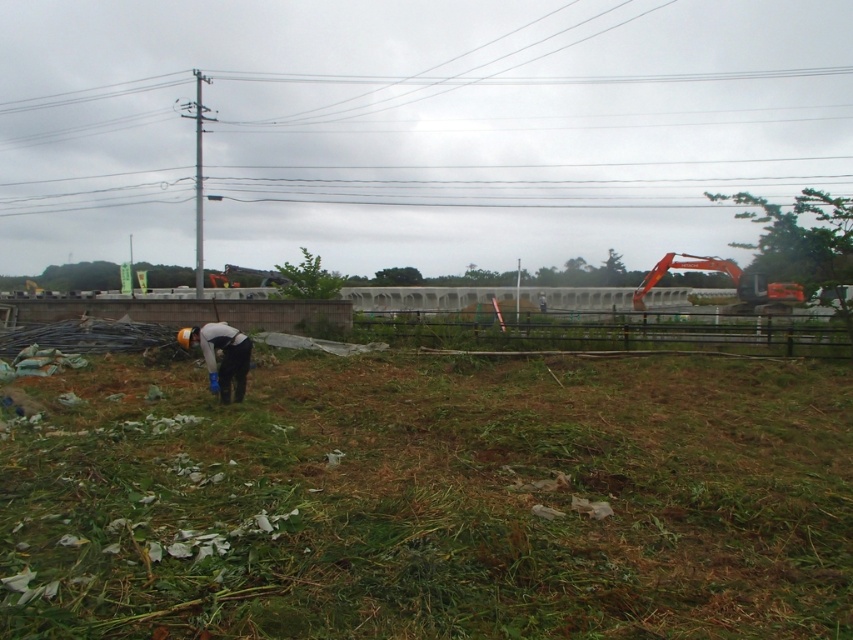
Question: In this image, where is green rough grass at lower left located relative to white fabric worker at center?

Choices:
 (A) right
 (B) left

Answer: (A)

Question: Does green rough grass at lower left appear on the left side of white fabric worker at center?

Choices:
 (A) yes
 (B) no

Answer: (B)

Question: Which object appears farthest from the camera in this image?

Choices:
 (A) green rough grass at lower left
 (B) white fabric worker at center

Answer: (B)

Question: Which point is closer to the camera?

Choices:
 (A) [148, 628]
 (B) [204, 337]

Answer: (A)

Question: Considering the relative positions of green rough grass at lower left and white fabric worker at center in the image provided, where is green rough grass at lower left located with respect to white fabric worker at center?

Choices:
 (A) right
 (B) left

Answer: (A)